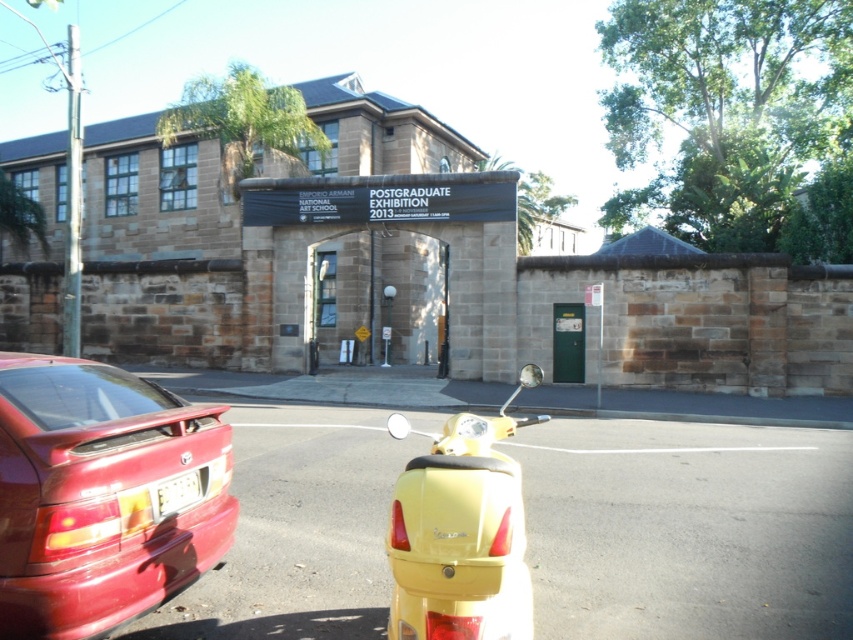
Question: Estimate the real-world distances between objects in this image. Which object is farther from the yellow matte scooter at center?

Choices:
 (A) yellow plastic license plate at lower center
 (B) glossy red car at lower left

Answer: (B)

Question: Among these points, which one is nearest to the camera?

Choices:
 (A) (73, 403)
 (B) (189, 480)

Answer: (A)

Question: Where is glossy red car at lower left located in relation to yellow matte scooter at center in the image?

Choices:
 (A) right
 (B) left

Answer: (B)

Question: Is glossy red car at lower left positioned before yellow matte scooter at center?

Choices:
 (A) yes
 (B) no

Answer: (A)

Question: From the image, what is the correct spatial relationship of glossy red car at lower left in relation to yellow matte scooter at center?

Choices:
 (A) left
 (B) right

Answer: (A)

Question: Based on their relative distances, which object is nearer to the glossy red car at lower left?

Choices:
 (A) yellow matte scooter at center
 (B) yellow plastic license plate at lower center

Answer: (B)